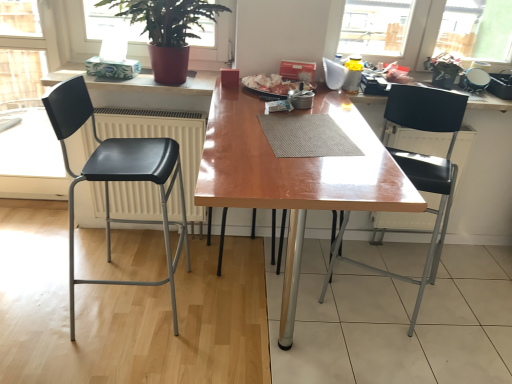
Question: Is matte red pot at upper left spatially inside wooden table at center, or outside of it?

Choices:
 (A) inside
 (B) outside

Answer: (B)

Question: From a real-world perspective, is matte red pot at upper left positioned above or below wooden table at center?

Choices:
 (A) below
 (B) above

Answer: (B)

Question: Which object is the farthest from the black plastic chair at right, which is the 2th chair in left-to-right order?

Choices:
 (A) matte red pot at upper left
 (B) wooden table at center
 (C) matte plastic counter top at upper left
 (D) black matte chair at left, which is counted as the 1th chair, starting from the left

Answer: (C)

Question: Considering the real-world distances, which object is closest to the black matte chair at left, which is counted as the 1th chair, starting from the left?

Choices:
 (A) wooden table at center
 (B) black plastic chair at right, marked as the 1th chair in a right-to-left arrangement
 (C) matte plastic counter top at upper left
 (D) matte red pot at upper left

Answer: (D)